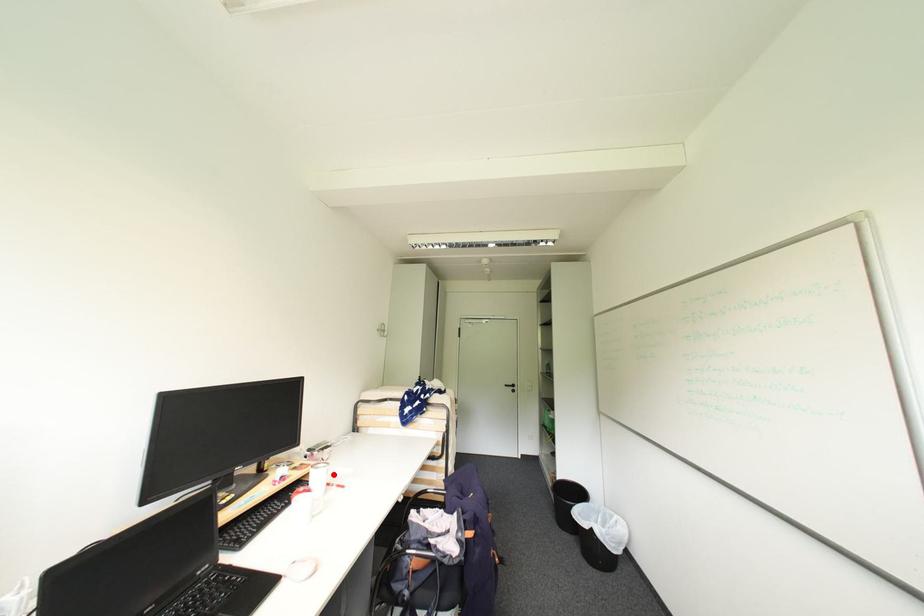
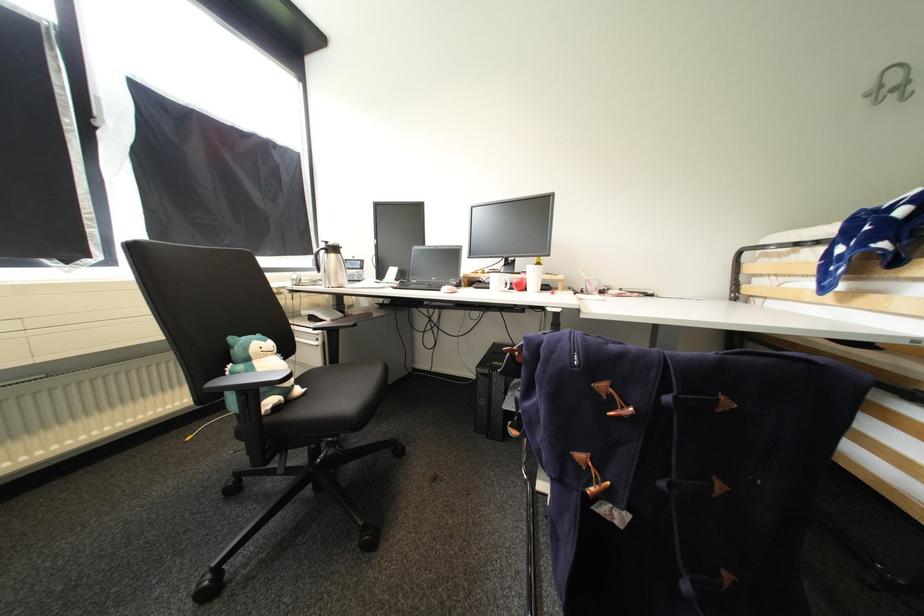
Question: I am providing you with two images of the same scene from different viewpoints. A red point is marked on the first image. Can you still see the location of the red point in image 2?

Choices:
 (A) Yes
 (B) No

Answer: (A)